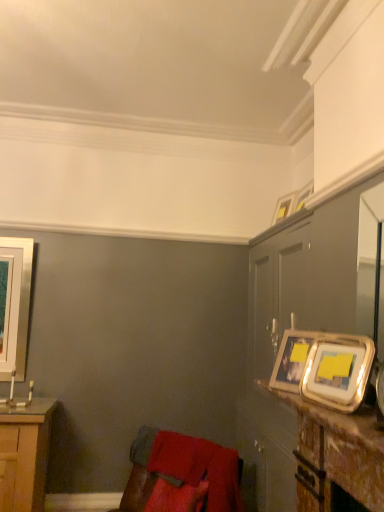
In order to face silver metallic picture frame at left, the first picture frame viewed from the back, should I rotate leftwards or rightwards?

A 22.992 degree turn to the left will do.

Describe the element at coordinates (337, 450) in the screenshot. Image resolution: width=384 pixels, height=512 pixels. I see `wooden table at right` at that location.

Locate an element on the screen. This screenshot has width=384, height=512. metallic gold frame at upper right is located at coordinates (304, 362).

Which object is wider, metallic gold picture frame at upper right, the second picture frame in the back-to-front sequence, or wooden table at right?

With larger width is wooden table at right.

Are metallic gold picture frame at upper right, which is counted as the 4th picture frame, starting from the left, and wooden table at right far apart?

Yes, metallic gold picture frame at upper right, which is counted as the 4th picture frame, starting from the left, and wooden table at right are located far from each other.

From their relative heights in the image, would you say metallic gold picture frame at upper right, which is counted as the 4th picture frame, starting from the left, is taller or shorter than wooden table at right?

Considering their sizes, metallic gold picture frame at upper right, which is counted as the 4th picture frame, starting from the left, has more height than wooden table at right.

Does velvet red swivel chair at lower left have a smaller size compared to silver metallic picture frame at left, the first picture frame viewed from the back?

Actually, velvet red swivel chair at lower left might be larger than silver metallic picture frame at left, the first picture frame viewed from the back.

From a real-world perspective, who is located higher, velvet red swivel chair at lower left or silver metallic picture frame at left, positioned as the fourth picture frame in right-to-left order?

In real-world perspective, silver metallic picture frame at left, positioned as the fourth picture frame in right-to-left order, is above.

Is velvet red swivel chair at lower left looking in the opposite direction of silver metallic picture frame at left, positioned as the fourth picture frame in right-to-left order?

velvet red swivel chair at lower left does not have its back to silver metallic picture frame at left, positioned as the fourth picture frame in right-to-left order.

Considering the positions of objects velvet red swivel chair at lower left and silver metallic picture frame at left, the 4th picture frame from the front, in the image provided, who is more to the right, velvet red swivel chair at lower left or silver metallic picture frame at left, the 4th picture frame from the front,?

Positioned to the right is velvet red swivel chair at lower left.

Is velvet red swivel chair at lower left placed right next to metallic gold frame at upper right?

No, velvet red swivel chair at lower left is not in contact with metallic gold frame at upper right.

Which is more to the left, velvet red swivel chair at lower left or metallic gold frame at upper right?

Positioned to the left is velvet red swivel chair at lower left.

Locate an element on the screen. dresser directly beneath the wooden table at right (from a real-world perspective) is located at coordinates tap(304, 362).

Does metallic gold frame at upper right come in front of wooden table at right?

No, metallic gold frame at upper right is further to the viewer.

Could you tell me if metallic gold frame at upper right is facing wooden table at right?

No, metallic gold frame at upper right is not turned towards wooden table at right.

From a real-world perspective, which is physically above, metallic gold frame at upper right or wooden table at right?

In real-world perspective, wooden table at right is above.

From the picture: Is metallic silver picture frame at upper right, arranged as the 2th picture frame when viewed from the left, positioned far away from velvet red swivel chair at lower left?

metallic silver picture frame at upper right, arranged as the 2th picture frame when viewed from the left, is positioned a significant distance from velvet red swivel chair at lower left.

Is velvet red swivel chair at lower left at the back of metallic silver picture frame at upper right, the second picture frame in the front-to-back sequence?

No, metallic silver picture frame at upper right, the second picture frame in the front-to-back sequence,'s orientation is not away from velvet red swivel chair at lower left.

Looking at this image, considering the sizes of objects metallic silver picture frame at upper right, the third picture frame positioned from the back, and velvet red swivel chair at lower left in the image provided, who is wider, metallic silver picture frame at upper right, the third picture frame positioned from the back, or velvet red swivel chair at lower left?

velvet red swivel chair at lower left is wider.

Which of these two, wooden table at right or velvet red swivel chair at lower left, stands shorter?

wooden table at right is shorter.

Is wooden table at right thinner than velvet red swivel chair at lower left?

In fact, wooden table at right might be wider than velvet red swivel chair at lower left.

Does point (309, 433) come closer to viewer compared to point (152, 428)?

Yes, point (309, 433) is in front of point (152, 428).

In the scene shown: Which is correct: wooden table at right is inside velvet red swivel chair at lower left, or outside of it?

wooden table at right lies outside velvet red swivel chair at lower left.

Considering the positions of point (309, 184) and point (346, 329), is point (309, 184) closer or farther from the camera than point (346, 329)?

Point (309, 184).

From a real-world perspective, is metallic gold picture frame at upper right, marked as the 3th picture frame in a front-to-back arrangement, positioned above or below metallic gold frame at upper right?

metallic gold picture frame at upper right, marked as the 3th picture frame in a front-to-back arrangement, is above metallic gold frame at upper right.

Relative to metallic gold frame at upper right, is metallic gold picture frame at upper right, which is counted as the 4th picture frame, starting from the left, in front or behind?

Visually, metallic gold picture frame at upper right, which is counted as the 4th picture frame, starting from the left, is located behind metallic gold frame at upper right.

In the scene shown: Which of these two, metallic gold picture frame at upper right, the second picture frame in the back-to-front sequence, or metallic gold frame at upper right, stands taller?

With more height is metallic gold frame at upper right.

Locate an element on the screen. table in front of the metallic gold picture frame at upper right, which is the 1th picture frame from right to left is located at coordinates point(337,450).

The height and width of the screenshot is (512, 384). I want to click on swivel chair below the silver metallic picture frame at left, positioned as the fourth picture frame in right-to-left order (from the image's perspective), so (180, 475).

Which object lies further to the anchor point metallic silver picture frame at upper right, the second picture frame in the front-to-back sequence, silver metallic picture frame at left, the 4th picture frame from the front, or metallic gold frame at upper right?

Based on the image, silver metallic picture frame at left, the 4th picture frame from the front, appears to be further to metallic silver picture frame at upper right, the second picture frame in the front-to-back sequence.

Which object lies nearer to the anchor point metallic gold frame at upper right, velvet red swivel chair at lower left or wooden table at right?

wooden table at right lies closer to metallic gold frame at upper right than the other object.

Looking at the image, which one is located further to metallic silver picture frame at upper right, the second picture frame in the front-to-back sequence, velvet red swivel chair at lower left or metallic gold picture frame at upper right, the second picture frame in the back-to-front sequence?

The object further to metallic silver picture frame at upper right, the second picture frame in the front-to-back sequence, is velvet red swivel chair at lower left.

Estimate the real-world distances between objects in this image. Which object is further from silver metallic picture frame at right, which appears as the second picture frame when viewed from the right, metallic gold picture frame at upper right, the second picture frame in the back-to-front sequence, or velvet red swivel chair at lower left?

Based on the image, velvet red swivel chair at lower left appears to be further to silver metallic picture frame at right, which appears as the second picture frame when viewed from the right.

Which object lies further to the anchor point silver metallic picture frame at left, positioned as the fourth picture frame in right-to-left order, metallic gold frame at upper right or metallic gold picture frame at upper right, which is counted as the 4th picture frame, starting from the left?

Based on the image, metallic gold picture frame at upper right, which is counted as the 4th picture frame, starting from the left, appears to be further to silver metallic picture frame at left, positioned as the fourth picture frame in right-to-left order.

Considering their positions, is metallic gold picture frame at upper right, which is the 1th picture frame from right to left, positioned closer to silver metallic picture frame at left, the first picture frame viewed from the back, than metallic silver picture frame at upper right, acting as the 3th picture frame starting from the right?

Among the two, metallic silver picture frame at upper right, acting as the 3th picture frame starting from the right, is located nearer to silver metallic picture frame at left, the first picture frame viewed from the back.

From the image, which object appears to be nearer to metallic gold frame at upper right, wooden table at right or silver metallic picture frame at right, the first picture frame positioned from the front?

wooden table at right is positioned closer to the anchor metallic gold frame at upper right.

Based on their spatial positions, is metallic gold frame at upper right or wooden table at right closer to silver metallic picture frame at left, the first picture frame viewed from the back?

Among the two, metallic gold frame at upper right is located nearer to silver metallic picture frame at left, the first picture frame viewed from the back.

Find the location of a particular element. This screenshot has height=512, width=384. dresser positioned between wooden table at right and velvet red swivel chair at lower left from near to far is located at coordinates (304, 362).

You are a GUI agent. You are given a task and a screenshot of the screen. Output one action in this format:
    pyautogui.click(x=<x>, y=<y>)
    Task: Click on the swivel chair situated between silver metallic picture frame at left, the 4th picture frame from the front, and metallic gold picture frame at upper right, which is counted as the 4th picture frame, starting from the left, from left to right
    This screenshot has height=512, width=384.
    Given the screenshot: What is the action you would take?
    pyautogui.click(x=180, y=475)

Find the location of `swivel chair between silver metallic picture frame at left, the 4th picture frame from the front, and silver metallic picture frame at right, placed as the third picture frame when sorted from left to right, in the horizontal direction`. swivel chair between silver metallic picture frame at left, the 4th picture frame from the front, and silver metallic picture frame at right, placed as the third picture frame when sorted from left to right, in the horizontal direction is located at coordinates (180, 475).

You are a GUI agent. You are given a task and a screenshot of the screen. Output one action in this format:
    pyautogui.click(x=<x>, y=<y>)
    Task: Click on the picture frame located between silver metallic picture frame at right, which appears as the second picture frame when viewed from the right, and metallic gold picture frame at upper right, marked as the 3th picture frame in a front-to-back arrangement, in the depth direction
    
    Given the screenshot: What is the action you would take?
    pyautogui.click(x=291, y=360)